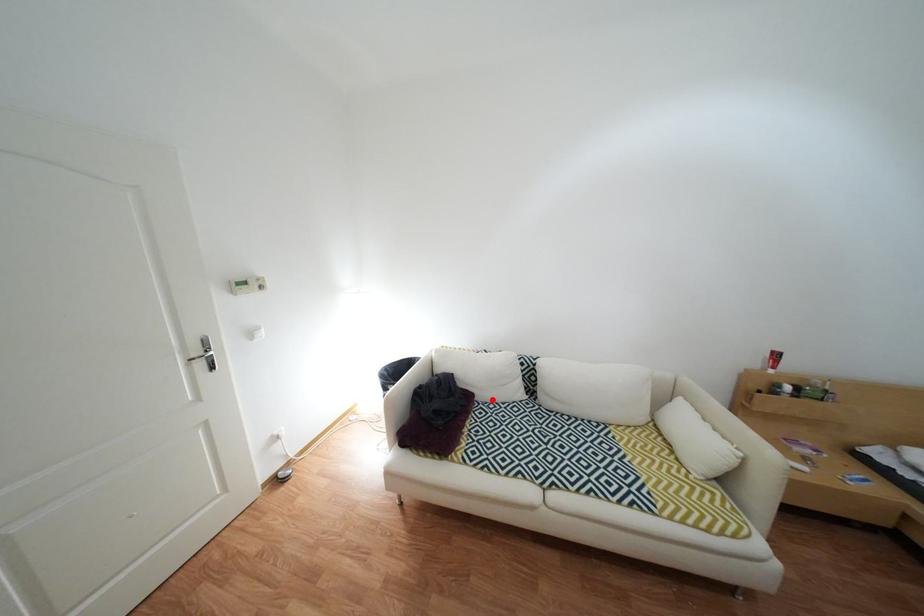
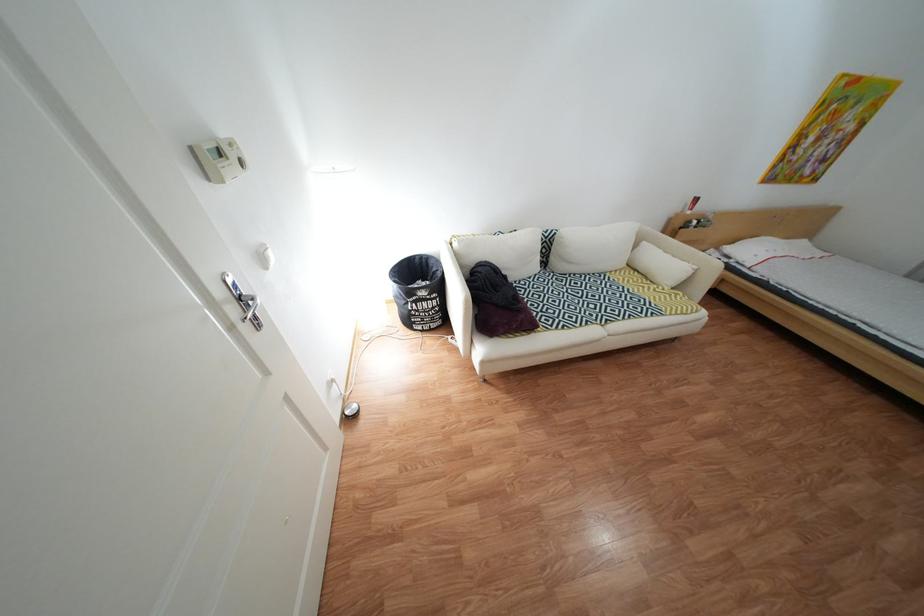
In the second image, find the point that corresponds to the highlighted location in the first image.

(525, 281)